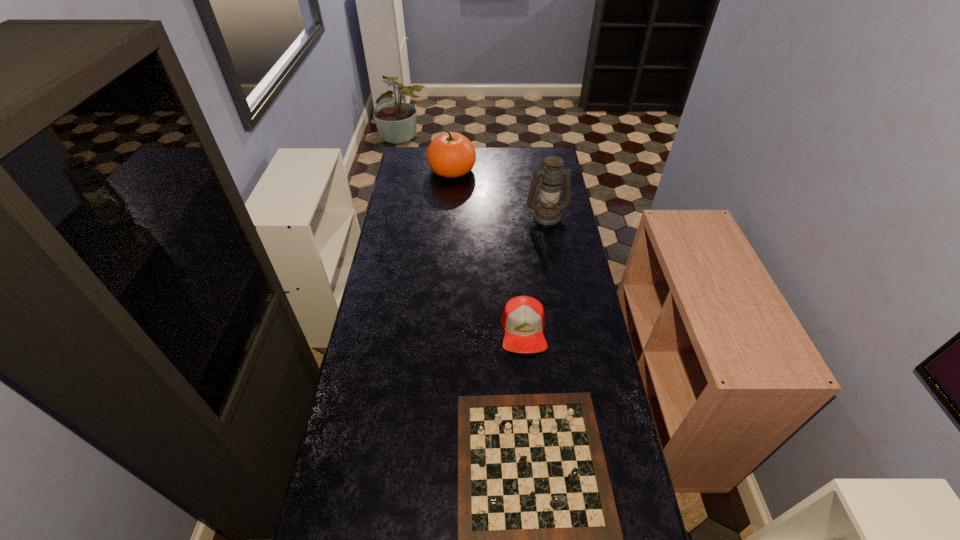
This screenshot has height=540, width=960. I want to click on object that is at the right edge, so click(x=547, y=212).

Identify the location of object located in the far left corner section of the desktop. The width and height of the screenshot is (960, 540). (450, 155).

Image resolution: width=960 pixels, height=540 pixels. What are the coordinates of `free location at the far edge` in the screenshot? It's located at (527, 161).

In the image, there is a desktop. At what (x,y) coordinates should I click in order to perform the action: click on free space at the left edge. Please return your answer as a coordinate pair (x, y). Looking at the image, I should click on (373, 465).

Where is `vacant space at the right edge`? vacant space at the right edge is located at coordinates (568, 214).

In the image, there is a desktop. Find the location of `free region at the far left corner`. free region at the far left corner is located at coordinates (403, 165).

What are the coordinates of `empty space between the third farthest object and the tallest object` in the screenshot? It's located at (536, 273).

You are a GUI agent. You are given a task and a screenshot of the screen. Output one action in this format:
    pyautogui.click(x=<x>, y=<y>)
    Task: Click on the blank region between the tallest object and the farthest object
    
    Given the screenshot: What is the action you would take?
    tap(499, 193)

Find the location of a particular element. free space between the baseball cap and the farthest object is located at coordinates (488, 250).

At what (x,y) coordinates should I click in order to perform the action: click on vacant space in between the second tallest object and the tallest object. Please return your answer as a coordinate pair (x, y). This screenshot has height=540, width=960. Looking at the image, I should click on pyautogui.click(x=499, y=193).